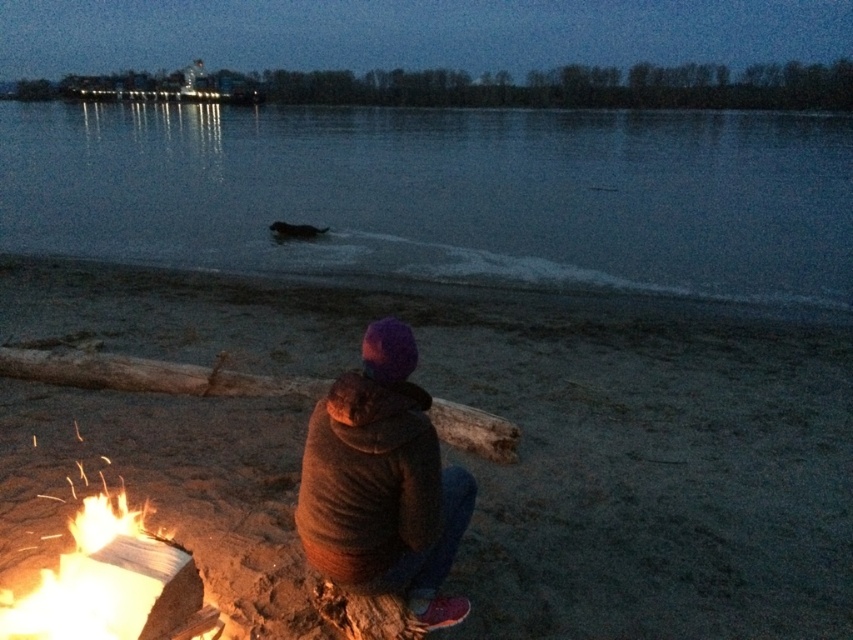
You are standing at the edge of the lake and want to place a buoy exactly at the center of the dark water at center. According to the coordinates provided, what are the coordinates where you should place the buoy?

The coordinates for placing the buoy at the center of the dark water at center are exactly at point (445, 195).

Consider the image. You are a hiker who wants to keep warm by the campfire. You see the purple woolen hat at center and the flaming wood at lower left. Which object is closer to you?

The flaming wood at lower left is closer to you because the purple woolen hat at center is located above it, meaning the hat is further away.